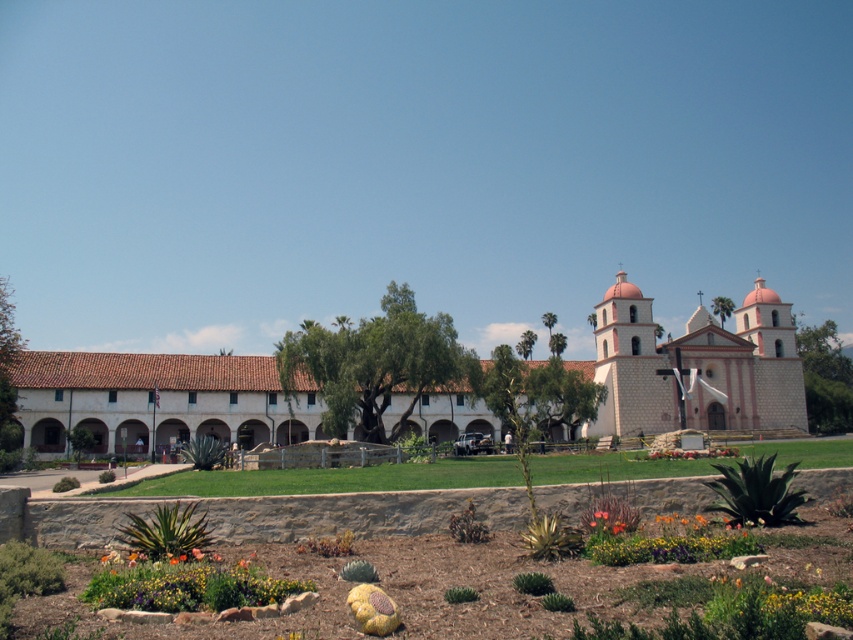
Question: Is multicolored mulch bed at lower center further to camera compared to multicolored fabric flower at lower center?

Choices:
 (A) yes
 (B) no

Answer: (B)

Question: Does white stucco building at center have a greater width compared to multicolored fabric flower at lower center?

Choices:
 (A) yes
 (B) no

Answer: (A)

Question: Which point is closer to the camera?

Choices:
 (A) multicolored fabric flower at lower center
 (B) multicolored mulch bed at lower center

Answer: (B)

Question: Does white stucco building at center appear on the left side of multicolored fabric flower at lower center?

Choices:
 (A) no
 (B) yes

Answer: (A)

Question: Which point is farther from the camera taking this photo?

Choices:
 (A) (715, 346)
 (B) (827, 547)
 (C) (281, 593)

Answer: (A)

Question: Which of the following is the closest to the observer?

Choices:
 (A) (439, 508)
 (B) (96, 586)
 (C) (788, 324)

Answer: (B)